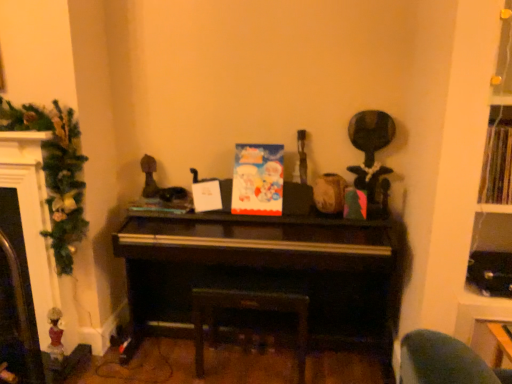
Question: Visually, is wooden book at upper right, acting as the second book starting from the left, positioned to the left or to the right of matte plastic book at center, which is counted as the 2th book, starting from the front?

Choices:
 (A) right
 (B) left

Answer: (A)

Question: In terms of size, does wooden book at upper right, the first book in the front-to-back sequence, appear bigger or smaller than matte plastic book at center, which is the 2th book from right to left?

Choices:
 (A) small
 (B) big

Answer: (B)

Question: Considering the real-world distances, which object is farthest from the dark wood stool at center?

Choices:
 (A) wooden book at upper right, acting as the second book starting from the left
 (B) matte plastic book at center, which is the 2th book from right to left
 (C) matte paper card at center
 (D) matte black fireplace at left
 (E) green textured garland at left

Answer: (A)

Question: Considering the real-world distances, which object is closest to the green textured garland at left?

Choices:
 (A) wooden book at upper right, the first book in the front-to-back sequence
 (B) matte plastic book at center, marked as the 1th book in a back-to-front arrangement
 (C) dark wood piano at center
 (D) matte black fireplace at left
 (E) dark wood stool at center

Answer: (D)